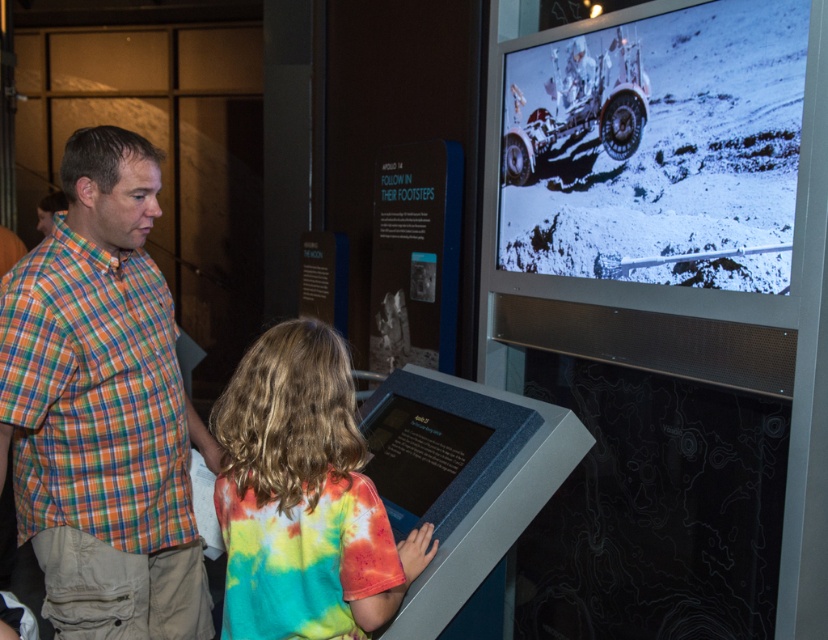
You are standing in a museum exhibit and see the multicolored plaid shirt at left. If you want to locate it precisely, what are its coordinates?

The multicolored plaid shirt at left is located at coordinates point (102, 408).

You are a visitor at the museum and want to touch the interactive display. There are two points on the touch panel labeled as point 1 at coordinates point 1 at coordinates point (2, 444) and point 2 at coordinates point (578, 164). Which point should you touch first if you want to activate the display from the front?

Point 1 at coordinates point (2, 444) is in front of point 2 at coordinates point (578, 164), so you should touch point 1 at coordinates point (2, 444) first to activate the display from the front.